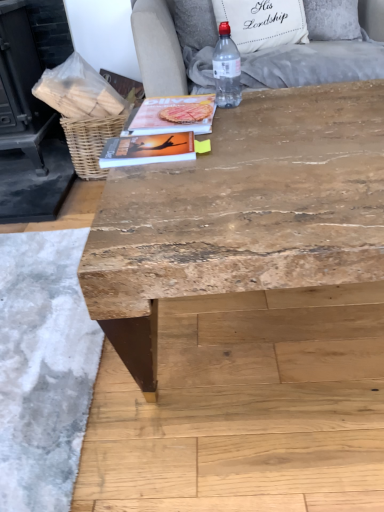
Question: Considering the positions of matte paper magazine at center, placed as the second magazine when sorted from bottom to top, and white fabric pillow at upper center in the image, is matte paper magazine at center, placed as the second magazine when sorted from bottom to top, bigger or smaller than white fabric pillow at upper center?

Choices:
 (A) small
 (B) big

Answer: (A)

Question: Is point (157, 104) positioned closer to the camera than point (228, 4)?

Choices:
 (A) closer
 (B) farther

Answer: (A)

Question: Estimate the real-world distances between objects in this image. Which object is closer to the matte orange book at center, which is the 2th magazine from top to bottom?

Choices:
 (A) clear plastic bottle at upper center
 (B) natural wood table at center
 (C) matte paper magazine at center, marked as the first magazine in a top-to-bottom arrangement
 (D) white fabric pillow at upper center
 (E) light gray fabric armchair at upper center

Answer: (C)

Question: Which object is the closest to the woven brown basket at upper left?

Choices:
 (A) light gray fabric armchair at upper center
 (B) natural wood table at center
 (C) matte paper magazine at center, the second magazine from the front
 (D) clear plastic bottle at upper center
 (E) white fabric pillow at upper center

Answer: (A)